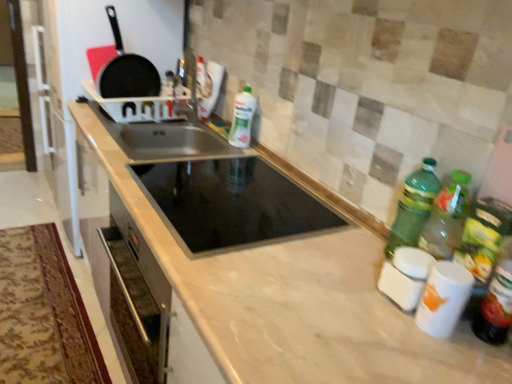
Locate an element on the screen. free space in front of green plastic bottle at right, the 2th bottle positioned from the top is located at coordinates (382, 306).